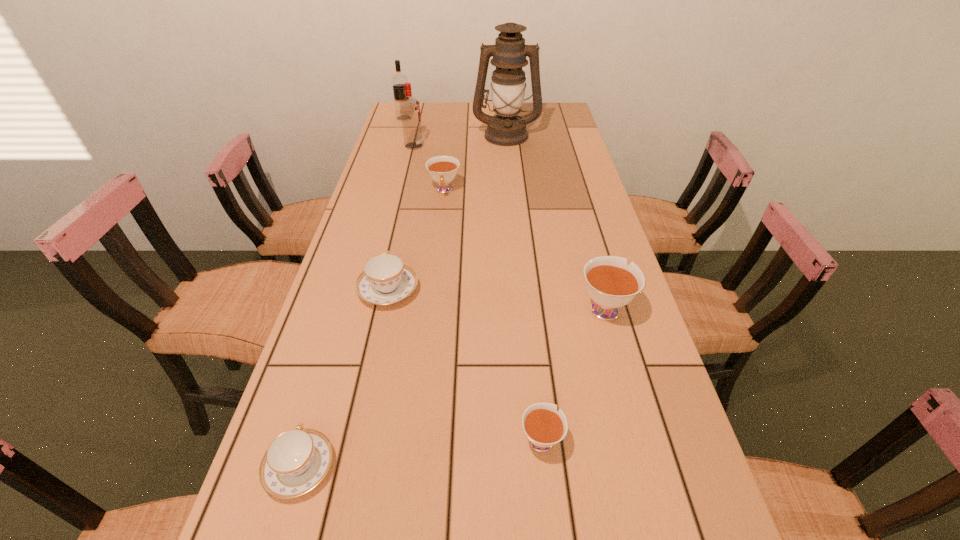
Locate an element on the screen. the smallest white teacup is located at coordinates (544, 427).

What are the coordinates of `the nearer blue teacup` in the screenshot? It's located at (297, 460).

Identify the location of vacant space situated on the right of the oil lamp. (552, 135).

The height and width of the screenshot is (540, 960). I want to click on vacant space located on the label of the farther vodka, so click(471, 118).

You are a GUI agent. You are given a task and a screenshot of the screen. Output one action in this format:
    pyautogui.click(x=<x>, y=<y>)
    Task: Click on the vacant space located 0.060m on the front label of the red vodka
    This screenshot has height=540, width=960.
    Given the screenshot: What is the action you would take?
    pyautogui.click(x=440, y=146)

Image resolution: width=960 pixels, height=540 pixels. I want to click on free space located on the side of the second farthest white teacup with the handle, so click(x=576, y=209).

I want to click on blank space located on the side of the second farthest white teacup with the handle, so click(x=590, y=259).

Identify the location of blank space located on the side of the second farthest white teacup with the handle. pos(592,266).

The height and width of the screenshot is (540, 960). Identify the location of vacant area located 0.060m on the side of the fifth nearest object with the handle. (442, 212).

Where is `vacant space located on the side with the handle of the farther blue teacup`? The height and width of the screenshot is (540, 960). vacant space located on the side with the handle of the farther blue teacup is located at coordinates (409, 195).